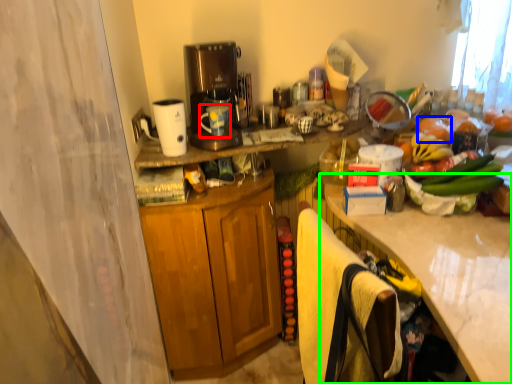
Question: Considering the real-world distances, which object is farthest from mug (highlighted by a red box)? fruit (highlighted by a blue box) or countertop (highlighted by a green box)?

Choices:
 (A) fruit
 (B) countertop

Answer: (B)